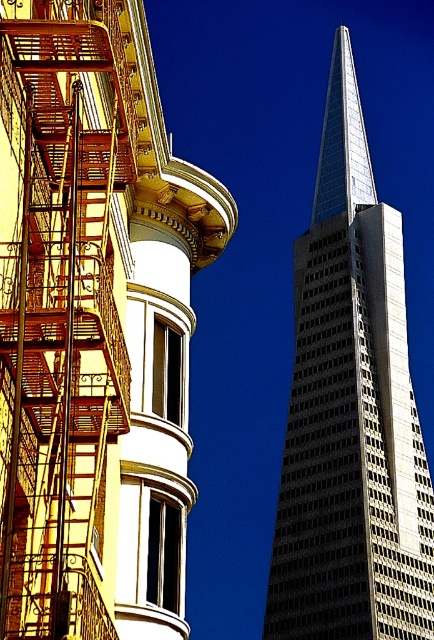
You are a photographer planning to capture both the rusty metal fire escape at left and the glassy silver skyscraper at center in a single frame. Given their sizes, which object should you position closer to the camera to ensure both are visible and balanced in the photo?

The rusty metal fire escape at left is smaller in size compared to the glassy silver skyscraper at center. To balance them in the photo, position the smaller rusty metal fire escape at left closer to the camera so it appears larger, while keeping the glassy silver skyscraper at center further back.

Consider the image. You are an architect analyzing the spatial relationship between the rusty metal fire escape at left and the glassy silver skyscraper at center. Based on their widths, which one would require more horizontal space if both were to be replicated in a model at the same scale?

The glassy silver skyscraper at center requires more horizontal space because its width is greater than the rusty metal fire escape at left.